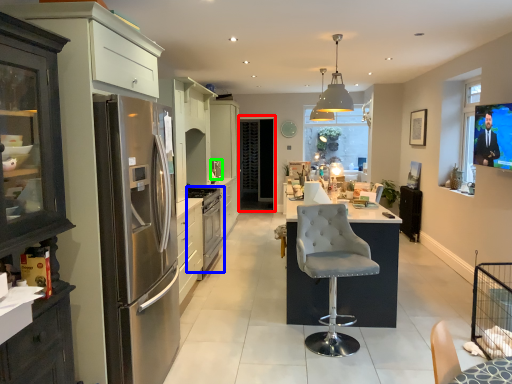
Question: Estimate the real-world distances between objects in this image. Which object is closer to glass door (highlighted by a red box), kitchen appliance (highlighted by a blue box) or appliance (highlighted by a green box)?

Choices:
 (A) kitchen appliance
 (B) appliance

Answer: (B)